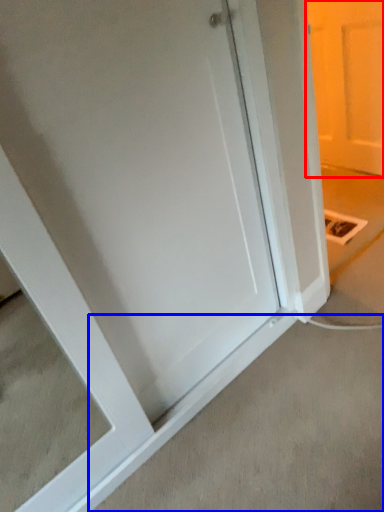
Question: Which object appears farthest to the camera in this image, door (highlighted by a red box) or concrete (highlighted by a blue box)?

Choices:
 (A) door
 (B) concrete

Answer: (A)